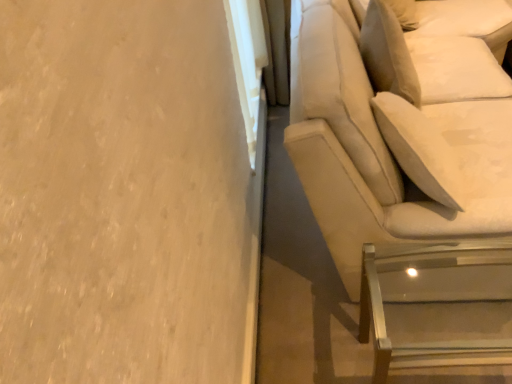
Question: Is beige fabric studio couch at right to the left or to the right of clear glass table at lower right in the image?

Choices:
 (A) right
 (B) left

Answer: (A)

Question: Looking at their shapes, would you say beige fabric studio couch at right is wider or thinner than clear glass table at lower right?

Choices:
 (A) wide
 (B) thin

Answer: (A)

Question: In terms of height, does beige fabric studio couch at right look taller or shorter compared to clear glass table at lower right?

Choices:
 (A) tall
 (B) short

Answer: (A)

Question: In the image, is clear glass table at lower right on the left side or the right side of beige fabric studio couch at right?

Choices:
 (A) left
 (B) right

Answer: (A)

Question: From a real-world perspective, is clear glass table at lower right above or below beige fabric studio couch at right?

Choices:
 (A) above
 (B) below

Answer: (B)

Question: In terms of width, does clear glass table at lower right look wider or thinner when compared to beige fabric studio couch at right?

Choices:
 (A) thin
 (B) wide

Answer: (A)

Question: Would you say clear glass table at lower right is inside or outside beige fabric studio couch at right?

Choices:
 (A) outside
 (B) inside

Answer: (A)